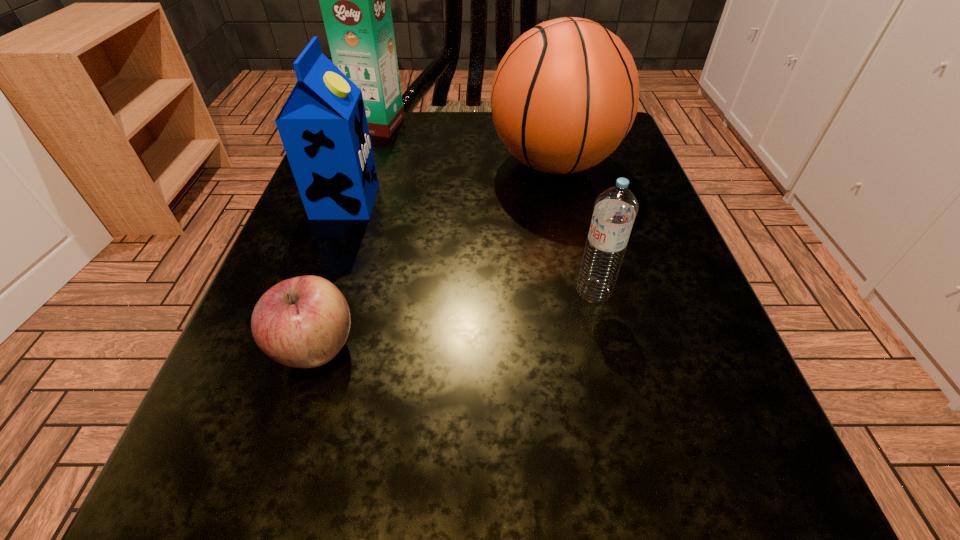
Identify the location of the farther carton. click(x=355, y=0).

Locate an element on the screen. This screenshot has width=960, height=540. basketball is located at coordinates (564, 96).

In order to click on the nearer carton in this screenshot , I will do `click(323, 127)`.

Locate an element on the screen. The width and height of the screenshot is (960, 540). the second nearest object is located at coordinates (615, 209).

Locate an element on the screen. This screenshot has width=960, height=540. the second shortest object is located at coordinates [x=615, y=209].

Where is `the shortest object`? This screenshot has height=540, width=960. the shortest object is located at coordinates (303, 322).

Find the location of a particular element. apple is located at coordinates (303, 322).

Identify the location of free space located 0.270m on the right of the farther carton. This screenshot has width=960, height=540. pos(533,125).

Identify the location of free space located 0.310m on the left of the basketball. This screenshot has height=540, width=960. (321, 164).

Where is `free space located 0.210m with the cap open on the nearer carton`? This screenshot has height=540, width=960. free space located 0.210m with the cap open on the nearer carton is located at coordinates (502, 201).